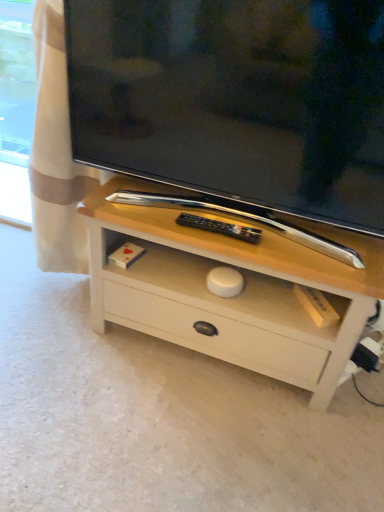
You are a GUI agent. You are given a task and a screenshot of the screen. Output one action in this format:
    pyautogui.click(x=<x>, y=<y>)
    Task: Click on the vacant space situated on the left part of white painted wood chest of drawers at center
    The image size is (384, 512).
    Given the screenshot: What is the action you would take?
    pyautogui.click(x=56, y=343)